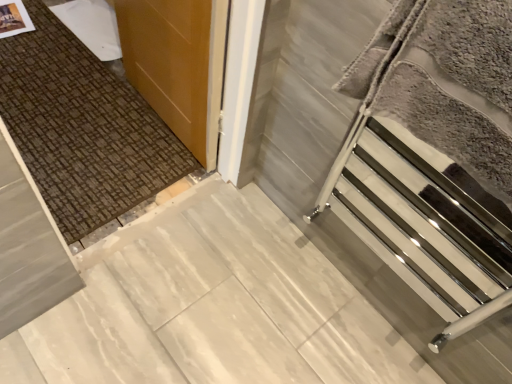
In order to face silver metallic towel rack at right, should I rotate leftwards or rightwards?

A 26.585 degree turn to the right will do.

The width and height of the screenshot is (512, 384). In order to click on wooden door at upper left in this screenshot , I will do `click(170, 62)`.

Who is bigger, polished chrome towel rack at right or wooden door at upper left?

With larger size is wooden door at upper left.

From a real-world perspective, is polished chrome towel rack at right over wooden door at upper left?

Yes, from a real-world perspective, polished chrome towel rack at right is over wooden door at upper left

From the image's perspective, would you say polished chrome towel rack at right is shown under wooden door at upper left?

Yes.

The width and height of the screenshot is (512, 384). I want to click on stairwell in front of the wooden door at upper left, so click(x=417, y=226).

The image size is (512, 384). I want to click on concrete on the left of silver metallic towel rack at right, so click(x=211, y=307).

Is white marble concrete at center with silver metallic towel rack at right?

No, white marble concrete at center is not beside silver metallic towel rack at right.

Does white marble concrete at center turn towards silver metallic towel rack at right?

No, white marble concrete at center is not facing towards silver metallic towel rack at right.

Who is more distant, white marble concrete at center or silver metallic towel rack at right?

white marble concrete at center is further away from the camera.

In the image, there is a silver metallic towel rack at right. Find the location of `concrete below it (from a real-world perspective)`. concrete below it (from a real-world perspective) is located at coordinates (211, 307).

From a real-world perspective, which is physically above, silver metallic towel rack at right or white marble concrete at center?

silver metallic towel rack at right is physically above.

Between silver metallic towel rack at right and white marble concrete at center, which one has larger size?

Bigger between the two is silver metallic towel rack at right.

Considering the sizes of objects silver metallic towel rack at right and white marble concrete at center in the image provided, who is taller, silver metallic towel rack at right or white marble concrete at center?

Standing taller between the two is silver metallic towel rack at right.

Does silver metallic towel rack at right have a lesser width compared to polished chrome towel rack at right?

Incorrect, the width of silver metallic towel rack at right is not less than that of polished chrome towel rack at right.

Looking at this image, could you tell me if silver metallic towel rack at right is turned towards polished chrome towel rack at right?

Yes, silver metallic towel rack at right faces towards polished chrome towel rack at right.

From their relative heights in the image, would you say silver metallic towel rack at right is taller or shorter than polished chrome towel rack at right?

Clearly, silver metallic towel rack at right is shorter compared to polished chrome towel rack at right.

Would you consider silver metallic towel rack at right to be distant from polished chrome towel rack at right?

No, silver metallic towel rack at right is not far away from polished chrome towel rack at right.

Considering the sizes of objects polished chrome towel rack at right and white marble concrete at center in the image provided, who is smaller, polished chrome towel rack at right or white marble concrete at center?

white marble concrete at center is smaller.

Are polished chrome towel rack at right and white marble concrete at center making contact?

No, polished chrome towel rack at right is not touching white marble concrete at center.

Is polished chrome towel rack at right positioned beyond the bounds of white marble concrete at center?

polished chrome towel rack at right is positioned outside white marble concrete at center.

Is polished chrome towel rack at right positioned with its back to white marble concrete at center?

No, polished chrome towel rack at right is not facing away from white marble concrete at center.

How different are the orientations of white marble concrete at center and polished chrome towel rack at right in degrees?

The facing directions of white marble concrete at center and polished chrome towel rack at right are 90.3 degrees apart.

Considering the relative sizes of white marble concrete at center and polished chrome towel rack at right in the image provided, is white marble concrete at center shorter than polished chrome towel rack at right?

→ Yes, white marble concrete at center is shorter than polished chrome towel rack at right.

From the image's perspective, does white marble concrete at center appear higher than polished chrome towel rack at right?

Incorrect, from the image's perspective, white marble concrete at center is lower than polished chrome towel rack at right.

Would you say white marble concrete at center is inside or outside polished chrome towel rack at right?

white marble concrete at center is not inside polished chrome towel rack at right, it's outside.

Are wooden door at upper left and silver metallic towel rack at right making contact?

No.

Can you confirm if wooden door at upper left is bigger than silver metallic towel rack at right?

Indeed, wooden door at upper left has a larger size compared to silver metallic towel rack at right.

Is silver metallic towel rack at right surrounded by wooden door at upper left?

No.

At what (x,y) coordinates should I click in order to perform the action: click on door behind the silver metallic towel rack at right. Please return your answer as a coordinate pair (x, y). Looking at the image, I should click on (170, 62).

Where is `door behind the polished chrome towel rack at right`? This screenshot has width=512, height=384. door behind the polished chrome towel rack at right is located at coordinates (170, 62).

Identify the location of blanket located above the white marble concrete at center (from the image's perspective). (445, 81).

Based on the photo, looking at the image, which one is located closer to white marble concrete at center, silver metallic towel rack at right or polished chrome towel rack at right?

polished chrome towel rack at right is positioned closer to the anchor white marble concrete at center.

Consider the image. Based on their spatial positions, is white marble concrete at center or polished chrome towel rack at right closer to wooden door at upper left?

white marble concrete at center lies closer to wooden door at upper left than the other object.

Considering their positions, is white marble concrete at center positioned closer to silver metallic towel rack at right than wooden door at upper left?

wooden door at upper left.

Based on their spatial positions, is silver metallic towel rack at right or white marble concrete at center further from wooden door at upper left?

silver metallic towel rack at right lies further to wooden door at upper left than the other object.

From the image, which object appears to be nearer to white marble concrete at center, polished chrome towel rack at right or wooden door at upper left?

polished chrome towel rack at right lies closer to white marble concrete at center than the other object.

Considering their positions, is polished chrome towel rack at right positioned further to silver metallic towel rack at right than wooden door at upper left?

wooden door at upper left lies further to silver metallic towel rack at right than the other object.

When comparing their distances from silver metallic towel rack at right, does polished chrome towel rack at right or white marble concrete at center seem closer?

polished chrome towel rack at right is closer to silver metallic towel rack at right.

Based on their spatial positions, is wooden door at upper left or white marble concrete at center further from polished chrome towel rack at right?

wooden door at upper left.

This screenshot has width=512, height=384. I want to click on stairwell between silver metallic towel rack at right and white marble concrete at center vertically, so click(417, 226).

Identify the location of blanket that lies between wooden door at upper left and white marble concrete at center from top to bottom. (445, 81).

I want to click on blanket between wooden door at upper left and polished chrome towel rack at right in the horizontal direction, so click(445, 81).

Where is `stairwell that lies between wooden door at upper left and white marble concrete at center from top to bottom`? Image resolution: width=512 pixels, height=384 pixels. stairwell that lies between wooden door at upper left and white marble concrete at center from top to bottom is located at coordinates (417, 226).